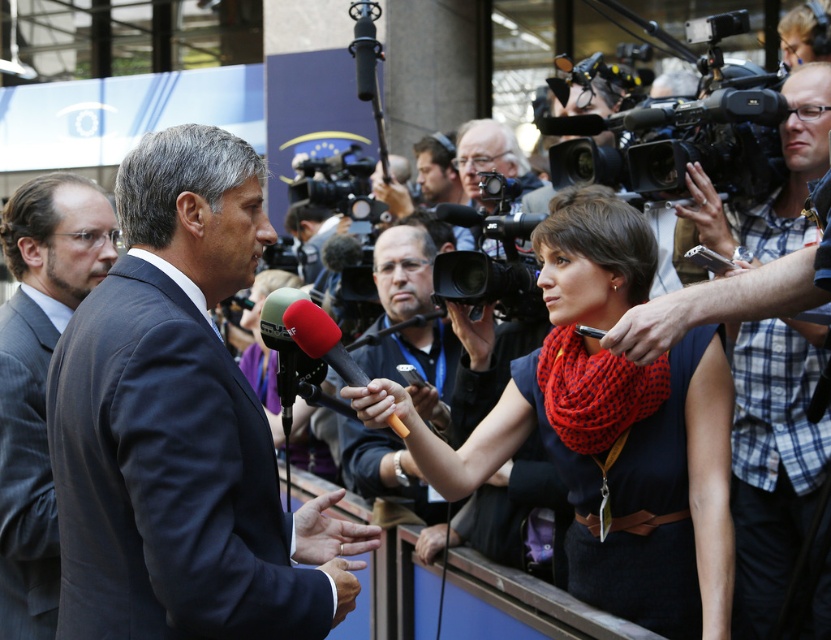
In the scene shown: Who is lower down, matte black microphone at center or plaid shirt at right?

Positioned lower is matte black microphone at center.

How far apart are matte black microphone at center and plaid shirt at right?

A distance of 5.63 feet exists between matte black microphone at center and plaid shirt at right.

Between point (445, 365) and point (706, 204), which one is positioned behind?

Point (445, 365)

Image resolution: width=831 pixels, height=640 pixels. Identify the location of matte black microphone at center. (416, 360).

Identify the location of dark gray suit at center. (180, 426).

Is dark gray suit at center thinner than gray suit at left?

No, dark gray suit at center is not thinner than gray suit at left.

Between point (180, 472) and point (47, 513), which one is positioned behind?

Positioned behind is point (47, 513).

I want to click on dark gray suit at center, so click(180, 426).

Can you confirm if gray suit at left is positioned below matte black microphone at center?

Yes.

Does gray suit at left appear on the right side of matte black microphone at center?

In fact, gray suit at left is to the left of matte black microphone at center.

Where is `gray suit at left`? This screenshot has height=640, width=831. gray suit at left is located at coordinates (38, 378).